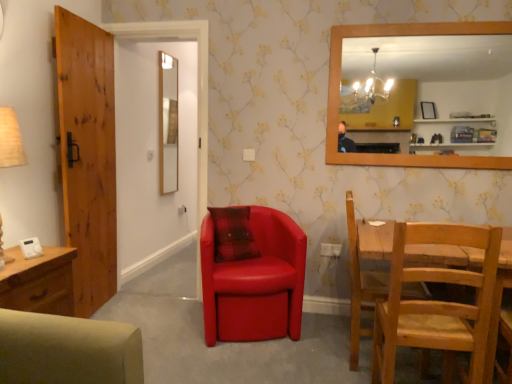
The image size is (512, 384). I want to click on vacant space to the left of matte red leather armchair at center, which is the first chair from left to right, so tap(165, 318).